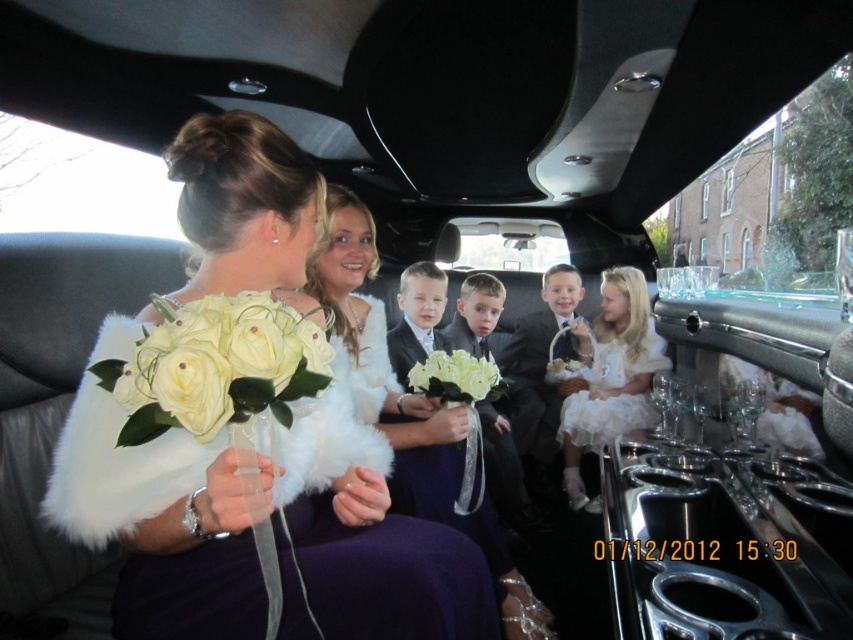
Consider the image. Between white fur shawl at upper left and white fur coat at center, which one is positioned lower?

Positioned lower is white fur coat at center.

Is white fur shawl at upper left bigger than white fur coat at center?

No.

This screenshot has height=640, width=853. What do you see at coordinates (160, 525) in the screenshot?
I see `white fur shawl at upper left` at bounding box center [160, 525].

Where is `white fur shawl at upper left`? white fur shawl at upper left is located at coordinates [x=160, y=525].

Does matte black suit at center have a larger size compared to white fluffy rose at center?

Yes, matte black suit at center is bigger than white fluffy rose at center.

Who is higher up, matte black suit at center or white fluffy rose at center?

white fluffy rose at center is above.

You are a GUI agent. You are given a task and a screenshot of the screen. Output one action in this format:
    pyautogui.click(x=<x>, y=<y>)
    Task: Click on the matte black suit at center
    The height and width of the screenshot is (640, 853).
    Given the screenshot: What is the action you would take?
    538,372

At what (x,y) coordinates should I click in order to perform the action: click on matte black suit at center. Please return your answer as a coordinate pair (x, y). The image size is (853, 640). Looking at the image, I should click on (538, 372).

In the scene shown: Between white silk bouquet at center and matte black suit at center, which one has more height?

matte black suit at center is taller.

Image resolution: width=853 pixels, height=640 pixels. I want to click on white silk bouquet at center, so click(x=218, y=365).

Locate an element on the screen. This screenshot has height=640, width=853. white silk bouquet at center is located at coordinates (218, 365).